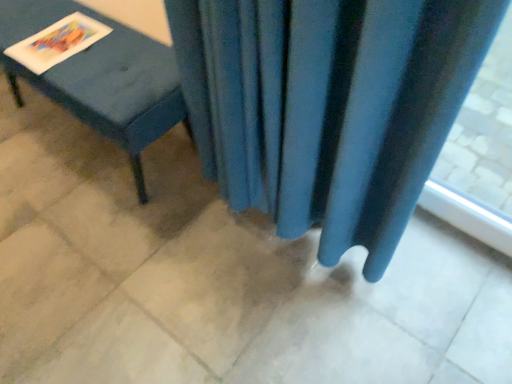
Image resolution: width=512 pixels, height=384 pixels. Find the location of `vacant area in front of velvet blue table at left`. vacant area in front of velvet blue table at left is located at coordinates (103, 252).